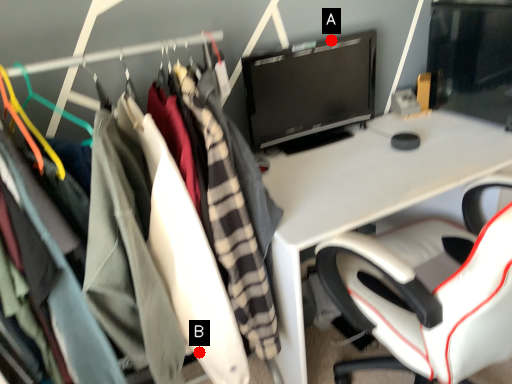
Question: Two points are circled on the image, labeled by A and B beside each circle. Which point appears closest to the camera in this image?

Choices:
 (A) A is closer
 (B) B is closer

Answer: (B)